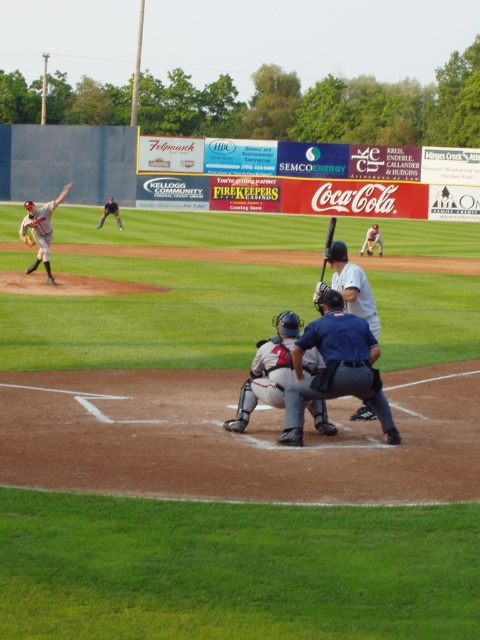
Question: Which point is farther to the camera?

Choices:
 (A) black matte baseball bat at center
 (B) gray matte catcher at center

Answer: (A)

Question: Which point is closer to the camera?

Choices:
 (A) (31, 211)
 (B) (27, 240)
 (C) (344, 294)
 (D) (327, 237)

Answer: (C)

Question: Is gray matte catcher at center positioned before matte gray uniform at left?

Choices:
 (A) no
 (B) yes

Answer: (B)

Question: Can you confirm if matte gray uniform at left is positioned to the right of matte gray helmet at center?

Choices:
 (A) no
 (B) yes

Answer: (A)

Question: Among these points, which one is nearest to the camera?

Choices:
 (A) (376, 228)
 (B) (98, 227)
 (C) (63, 196)

Answer: (C)

Question: Considering the relative positions of blue uniform at center and white matte baseball bat at center in the image provided, where is blue uniform at center located with respect to white matte baseball bat at center?

Choices:
 (A) above
 (B) below

Answer: (B)